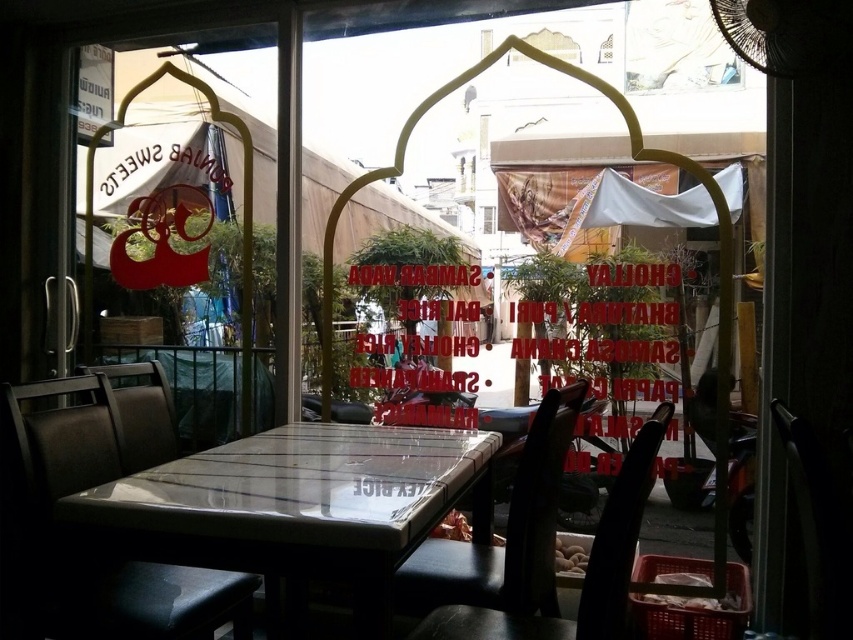
Who is more forward, (90, 154) or (146, 381)?

Point (146, 381)

Between transparent glass sign at upper left and matte black chair at center, which one is positioned lower?

Positioned lower is matte black chair at center.

Is point (250, 378) farther from camera compared to point (141, 468)?

That is True.

Image resolution: width=853 pixels, height=640 pixels. I want to click on transparent glass sign at upper left, so click(242, 212).

Between black leather chair at lower center and transparent glass window at center, which one appears on the right side from the viewer's perspective?

From the viewer's perspective, black leather chair at lower center appears more on the right side.

Does point (537, 625) lie behind point (492, 221)?

No, (537, 625) is closer to viewer.

Between point (451, 614) and point (494, 224), which one is positioned behind?

The point (494, 224) is more distant.

At what (x,y) coordinates should I click in order to perform the action: click on black leather chair at lower center. Please return your answer as a coordinate pair (x, y). Image resolution: width=853 pixels, height=640 pixels. Looking at the image, I should click on (585, 566).

Is the position of dark brown leather chair at center more distant than that of matte black chair at center?

No, it is in front of matte black chair at center.

Who is positioned more to the right, dark brown leather chair at center or matte black chair at center?

Positioned to the right is dark brown leather chair at center.

Is point (24, 460) behind point (125, 380)?

No, (24, 460) is in front of (125, 380).

I want to click on dark brown leather chair at center, so click(x=97, y=556).